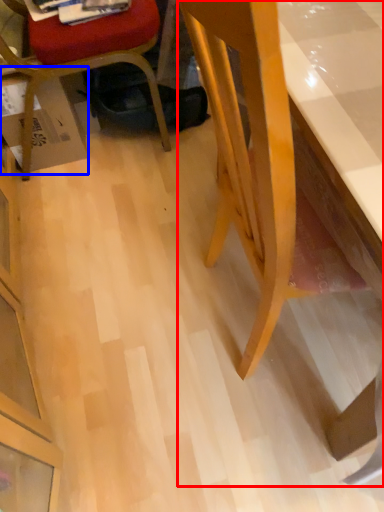
Question: Among these objects, which one is nearest to the camera, desk (highlighted by a red box) or cardboard box (highlighted by a blue box)?

Choices:
 (A) desk
 (B) cardboard box

Answer: (A)